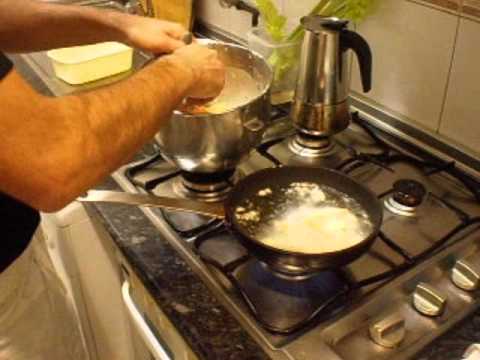
At what (x,y) coordinates should I click in order to perform the action: click on transparent bowl. Please return your answer as a coordinate pair (x, y). The width and height of the screenshot is (480, 360). Looking at the image, I should click on (288, 54).